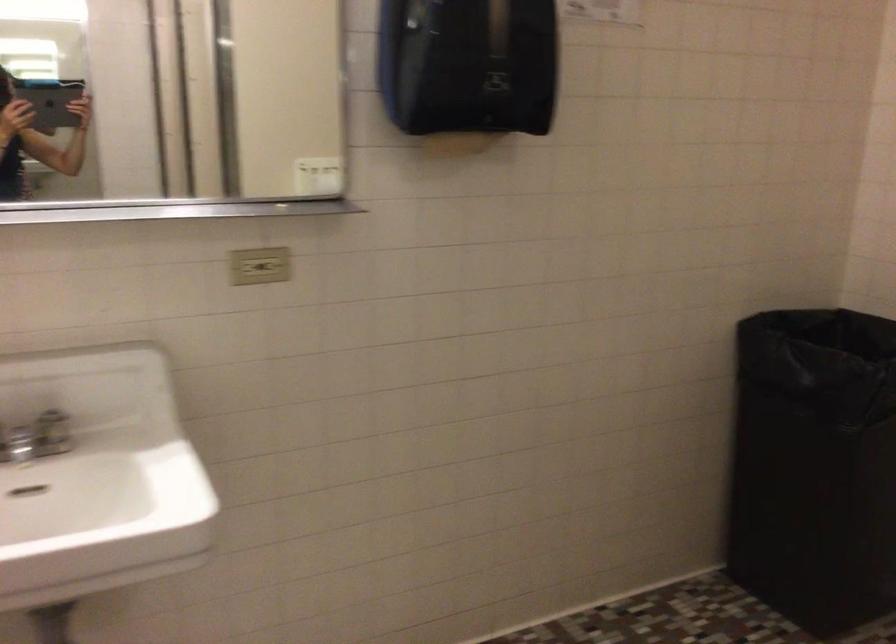
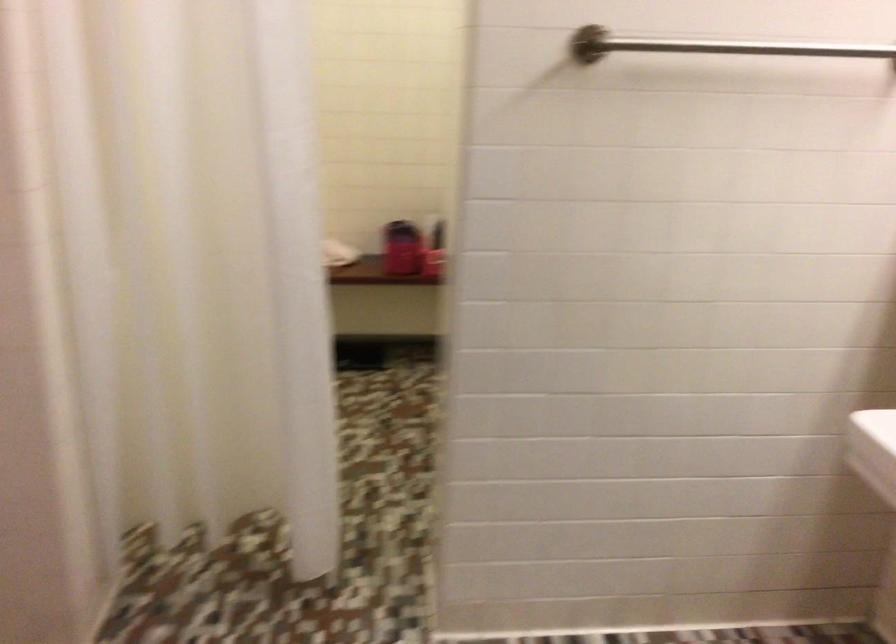
How did the camera likely rotate?

The camera's rotation is toward left-down.